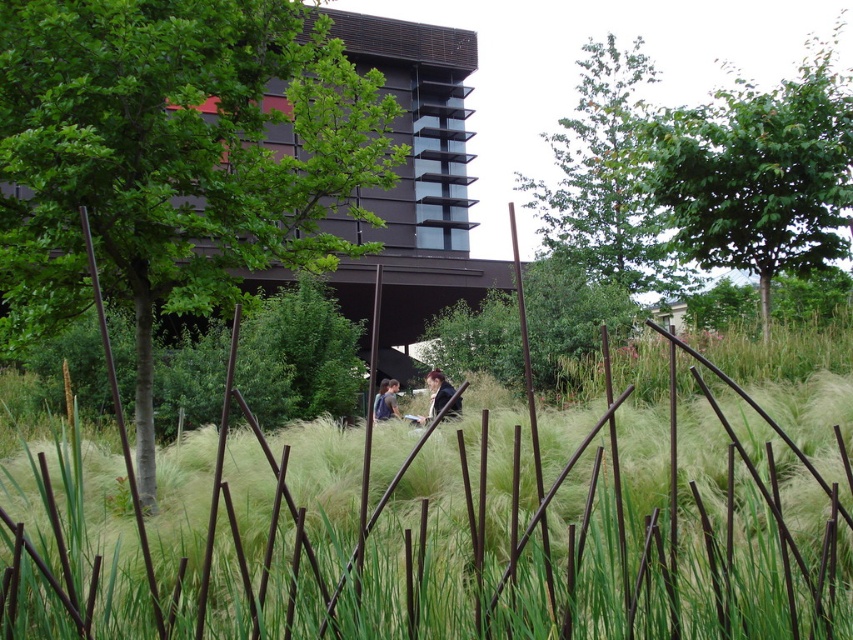
Consider the image. You are standing in the outdoor scene and want to walk from the green grass at center to the dark brown leather jacket at center. Which direction should you move to reach the jacket from the grass?

To reach the dark brown leather jacket at center from the green grass at center, you should move to the right since the green grass at center is positioned to the left of the jacket.